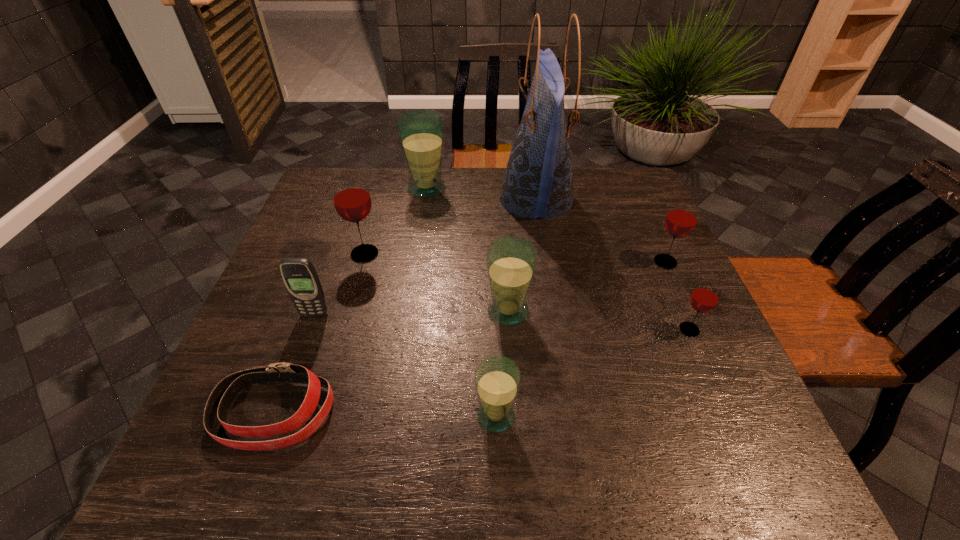
Identify the location of vacant region located 0.080m on the front of the nearest red glass. This screenshot has height=540, width=960. (708, 370).

I want to click on free space located 0.150m on the right of the smallest blue glass, so click(x=598, y=416).

You are a GUI agent. You are given a task and a screenshot of the screen. Output one action in this format:
    pyautogui.click(x=<x>, y=<y>)
    Task: Click on the blank area located 0.110m on the back of the dog collar
    
    Given the screenshot: What is the action you would take?
    pyautogui.click(x=302, y=333)

Where is `shopping bag that is positioned at the far edge`? shopping bag that is positioned at the far edge is located at coordinates (538, 182).

Find the location of `glass present at the far edge`. glass present at the far edge is located at coordinates (421, 132).

You are a GUI agent. You are given a task and a screenshot of the screen. Output one action in this format:
    pyautogui.click(x=<x>, y=<y>)
    Task: Click on the object that is at the near edge
    
    Given the screenshot: What is the action you would take?
    pyautogui.click(x=223, y=395)

Image resolution: width=960 pixels, height=540 pixels. I want to click on cellular telephone situated at the left edge, so click(x=299, y=275).

Locate an element on the screen. This screenshot has height=540, width=960. dog collar positioned at the left edge is located at coordinates (223, 395).

Identify the location of object that is at the near left corner. The width and height of the screenshot is (960, 540). (223, 395).

Image resolution: width=960 pixels, height=540 pixels. Find the location of `blank space at the far edge of the desktop`. blank space at the far edge of the desktop is located at coordinates (423, 199).